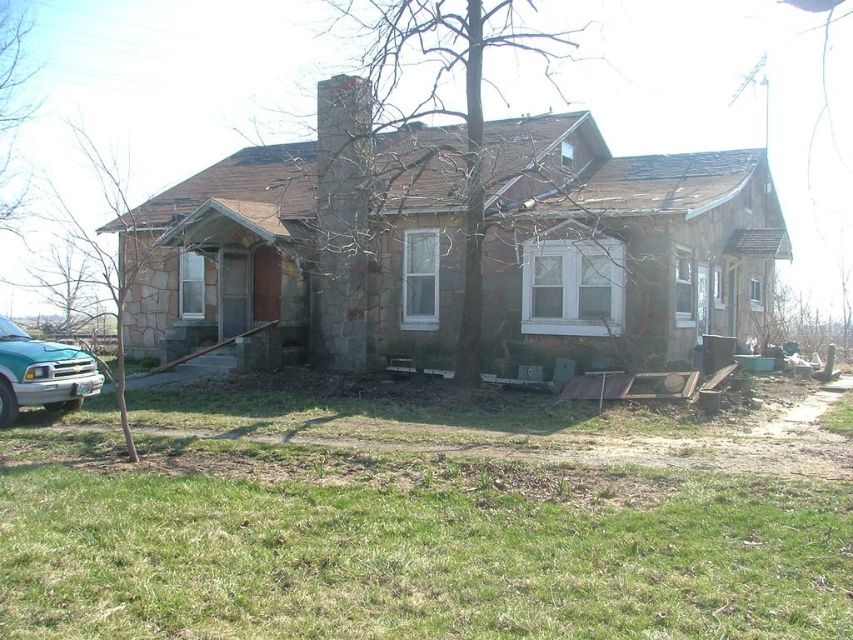
Does green grass at lower center have a lesser height compared to teal metallic truck at lower left?

Yes.

Does point (425, 445) come in front of point (86, 374)?

Yes, point (425, 445) is closer to viewer.

Identify the location of green grass at lower center. (425, 516).